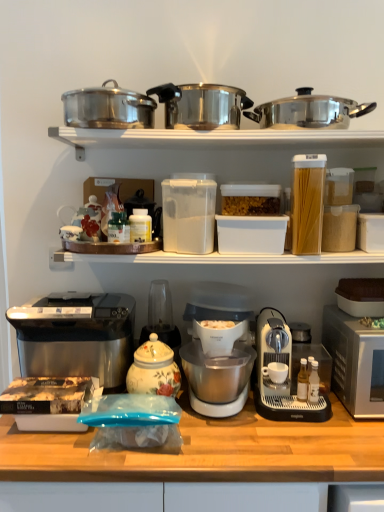
Question: Should I look upward or downward to see polished stainless steel pot at upper right, the 1th kitchen appliance when ordered from right to left?

Choices:
 (A) down
 (B) up

Answer: (B)

Question: Is metallic silver coffee maker at lower right, which is the 2th coffee maker from left to right, facing towards polished stainless steel pressure cooker at upper center, acting as the 3th kitchen appliance starting from the bottom?

Choices:
 (A) yes
 (B) no

Answer: (B)

Question: Is metallic silver coffee maker at lower right, which is the 2th coffee maker from left to right, oriented away from polished stainless steel pressure cooker at upper center, acting as the 3th kitchen appliance starting from the left?

Choices:
 (A) no
 (B) yes

Answer: (A)

Question: Can you confirm if metallic silver coffee maker at lower right, which is the 2th coffee maker from left to right, is thinner than polished stainless steel pressure cooker at upper center, acting as the 3th kitchen appliance starting from the bottom?

Choices:
 (A) yes
 (B) no

Answer: (B)

Question: From the image's perspective, is metallic silver coffee maker at lower right, which is counted as the first coffee maker, starting from the right, over polished stainless steel pressure cooker at upper center, the second kitchen appliance positioned from the right?

Choices:
 (A) no
 (B) yes

Answer: (A)

Question: Can you confirm if metallic silver coffee maker at lower right, which is the 2th coffee maker from left to right, is wider than polished stainless steel pressure cooker at upper center, acting as the 3th kitchen appliance starting from the bottom?

Choices:
 (A) no
 (B) yes

Answer: (B)

Question: Can you confirm if metallic silver coffee maker at lower right, which is counted as the first coffee maker, starting from the right, is bigger than polished stainless steel pressure cooker at upper center, acting as the 3th kitchen appliance starting from the bottom?

Choices:
 (A) no
 (B) yes

Answer: (B)

Question: From the image's perspective, is metallic pots at upper center on matte brown cake pan at right, the 2th appliance from the right?

Choices:
 (A) yes
 (B) no

Answer: (A)

Question: Considering the relative positions of metallic pots at upper center and matte brown cake pan at right, which is counted as the 3th appliance, starting from the left, in the image provided, is metallic pots at upper center to the right of matte brown cake pan at right, which is counted as the 3th appliance, starting from the left, from the viewer's perspective?

Choices:
 (A) no
 (B) yes

Answer: (A)

Question: Is metallic pots at upper center directly adjacent to matte brown cake pan at right, which is counted as the 3th appliance, starting from the left?

Choices:
 (A) yes
 (B) no

Answer: (B)

Question: From a real-world perspective, is metallic pots at upper center positioned over matte brown cake pan at right, the 2th appliance from the right, based on gravity?

Choices:
 (A) yes
 (B) no

Answer: (A)

Question: Can you confirm if metallic pots at upper center is smaller than matte brown cake pan at right, the 2th appliance from the right?

Choices:
 (A) yes
 (B) no

Answer: (B)

Question: Does metallic pots at upper center have a larger size compared to matte brown cake pan at right, which is counted as the 3th appliance, starting from the left?

Choices:
 (A) no
 (B) yes

Answer: (B)

Question: Is metallic pots at upper center thinner than white matte coffee cup at center?

Choices:
 (A) no
 (B) yes

Answer: (A)